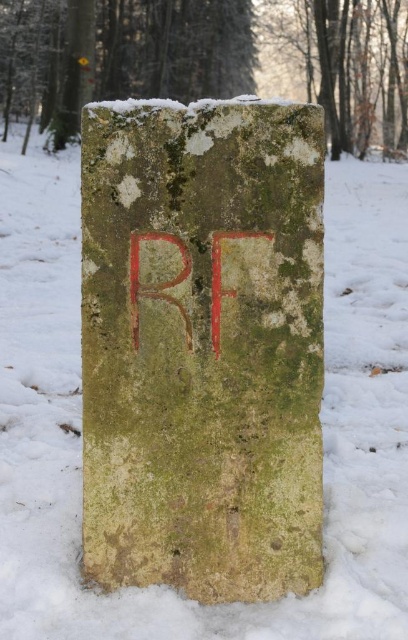
You are a hiker navigating a snowy forest and see two green mossy stones. One is at the center and the other at the upper left. Which direction should you walk to move from the green mossy stone at upper left to the green mossy stone at center?

To move from the green mossy stone at upper left to the green mossy stone at center, you should walk to the right since the green mossy stone at center is located to the right of the green mossy stone at upper left.

You are an archaeologist examining two green mossy stones in a snowy landscape. The scene shows a green mossy stone at center and a green mossy stone at upper left. Which of these stones is wider?

The green mossy stone at center is wider than the green mossy stone at upper left.